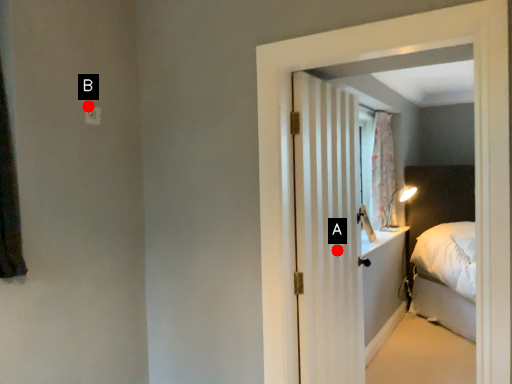
Question: Two points are circled on the image, labeled by A and B beside each circle. Which point appears closest to the camera in this image?

Choices:
 (A) A is closer
 (B) B is closer

Answer: (B)